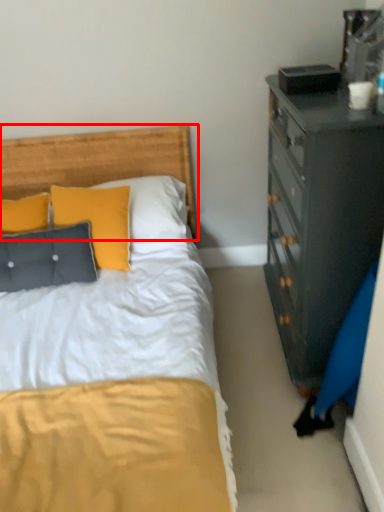
Question: From the image's perspective, what is the correct spatial positioning of headboard (annotated by the red box) in reference to pillow?

Choices:
 (A) above
 (B) below

Answer: (A)